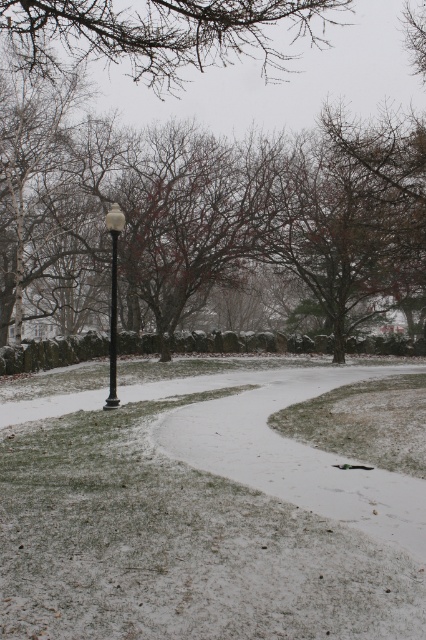
Who is positioned more to the left, snowy grass at lower center or white glossy lamp post at center?

white glossy lamp post at center is more to the left.

Can you confirm if snowy grass at lower center is positioned to the left of white glossy lamp post at center?

In fact, snowy grass at lower center is to the right of white glossy lamp post at center.

Where is `snowy grass at lower center`? Image resolution: width=426 pixels, height=640 pixels. snowy grass at lower center is located at coordinates (296, 452).

Where is `snowy grass at lower center`? The height and width of the screenshot is (640, 426). snowy grass at lower center is located at coordinates (296, 452).

Is point (34, 32) positioned before point (115, 218)?

Yes, it is.

Who is positioned more to the right, brown textured branches at upper center or white glossy lamp post at center?

brown textured branches at upper center is more to the right.

Describe the element at coordinates (166, 33) in the screenshot. I see `brown textured branches at upper center` at that location.

Locate an element on the screen. The image size is (426, 640). brown textured branches at upper center is located at coordinates (166, 33).

Based on the photo, can you confirm if snowy grass at lower center is thinner than brown textured branches at upper center?

Yes.

Who is taller, snowy grass at lower center or brown textured branches at upper center?

brown textured branches at upper center

What do you see at coordinates (296, 452) in the screenshot? This screenshot has width=426, height=640. I see `snowy grass at lower center` at bounding box center [296, 452].

Identify the location of snowy grass at lower center. This screenshot has height=640, width=426. (x=296, y=452).